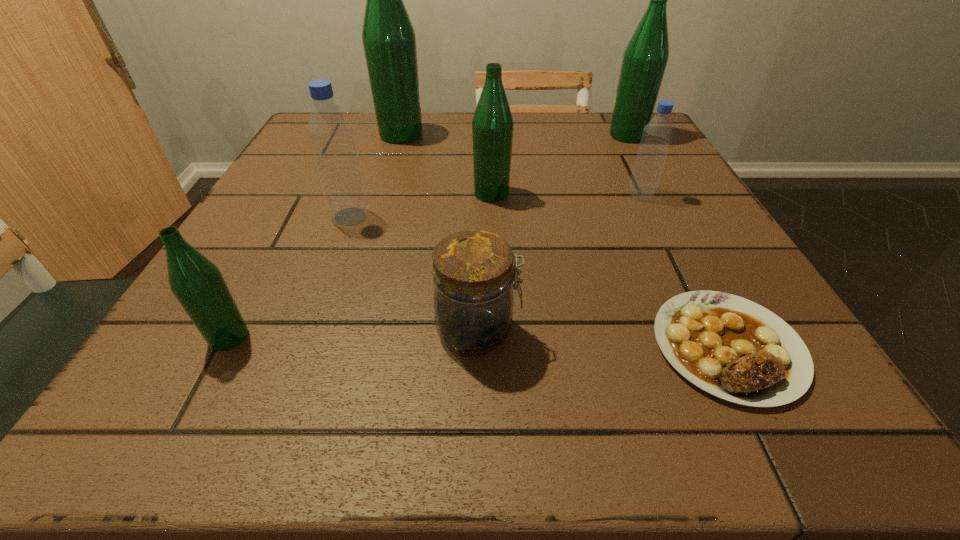
The height and width of the screenshot is (540, 960). Find the location of `free point located 0.140m on the lid of the second shortest object`. free point located 0.140m on the lid of the second shortest object is located at coordinates (621, 331).

The height and width of the screenshot is (540, 960). Find the location of `free region located 0.270m on the back of the shortest object`. free region located 0.270m on the back of the shortest object is located at coordinates (651, 197).

Find the location of `object positioned at the near edge`. object positioned at the near edge is located at coordinates (735, 349).

You are a GUI agent. You are given a task and a screenshot of the screen. Output one action in this format:
    pyautogui.click(x=<x>, y=<y>)
    Task: Click on the steak situated at the right edge
    
    Given the screenshot: What is the action you would take?
    pyautogui.click(x=735, y=349)

The image size is (960, 540). Find the location of `object at the far right corner`. object at the far right corner is located at coordinates (645, 58).

Where is `object that is at the near right corner`? object that is at the near right corner is located at coordinates (735, 349).

This screenshot has height=540, width=960. In the image, there is a desktop. Find the location of `vacant space at the far edge`. vacant space at the far edge is located at coordinates (424, 129).

This screenshot has height=540, width=960. In the image, there is a desktop. In order to click on free space at the near edge in this screenshot , I will do `click(517, 394)`.

At what (x,y) coordinates should I click in order to perform the action: click on vacant space at the left edge of the desktop. Please return your answer as a coordinate pair (x, y). Looking at the image, I should click on (246, 352).

Where is `vacant space at the right edge of the desktop`? This screenshot has height=540, width=960. vacant space at the right edge of the desktop is located at coordinates (746, 273).